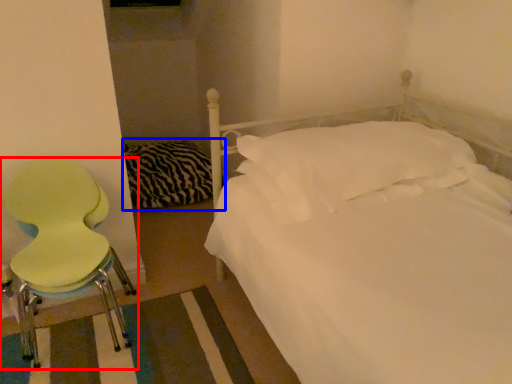
Question: Which point is closer to the camera, chair (highlighted by a red box) or bedding (highlighted by a blue box)?

Choices:
 (A) chair
 (B) bedding

Answer: (A)